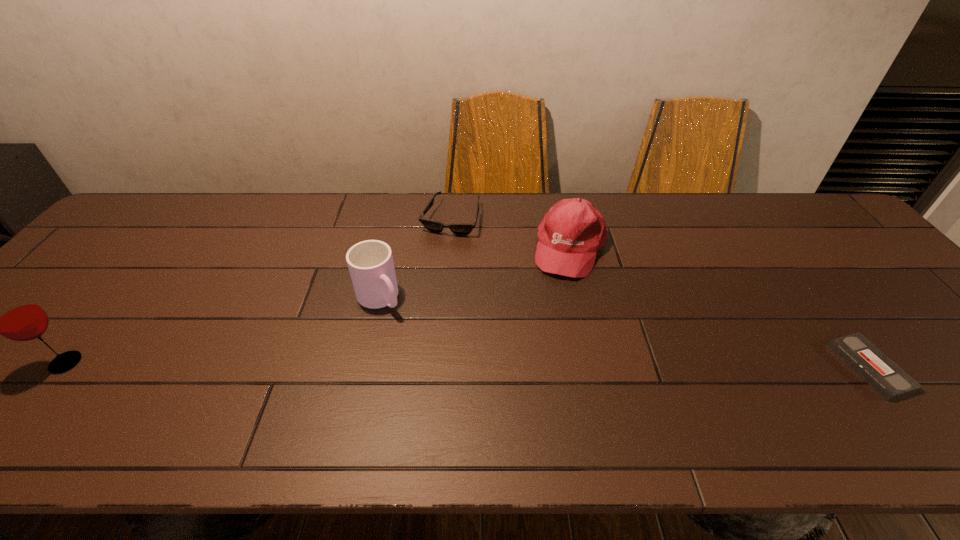
Where is `sunglasses present at the far edge`? The image size is (960, 540). sunglasses present at the far edge is located at coordinates (457, 228).

The height and width of the screenshot is (540, 960). Find the location of `glass that is at the near edge`. glass that is at the near edge is located at coordinates (13, 315).

I want to click on videotape that is at the near edge, so click(x=878, y=370).

This screenshot has width=960, height=540. I want to click on object that is at the left edge, so click(13, 315).

Image resolution: width=960 pixels, height=540 pixels. I want to click on object present at the near left corner, so click(x=13, y=315).

Find the location of `vacant space at the far edge of the desktop`. vacant space at the far edge of the desktop is located at coordinates (254, 198).

I want to click on free region at the near edge of the desktop, so click(x=858, y=376).

The height and width of the screenshot is (540, 960). What are the coordinates of `vacant space at the left edge` in the screenshot? It's located at (66, 338).

Where is `vacant space at the right edge of the desktop`? The width and height of the screenshot is (960, 540). vacant space at the right edge of the desktop is located at coordinates (925, 366).

Where is `vacant space at the far left corner of the desktop`? Image resolution: width=960 pixels, height=540 pixels. vacant space at the far left corner of the desktop is located at coordinates (174, 210).